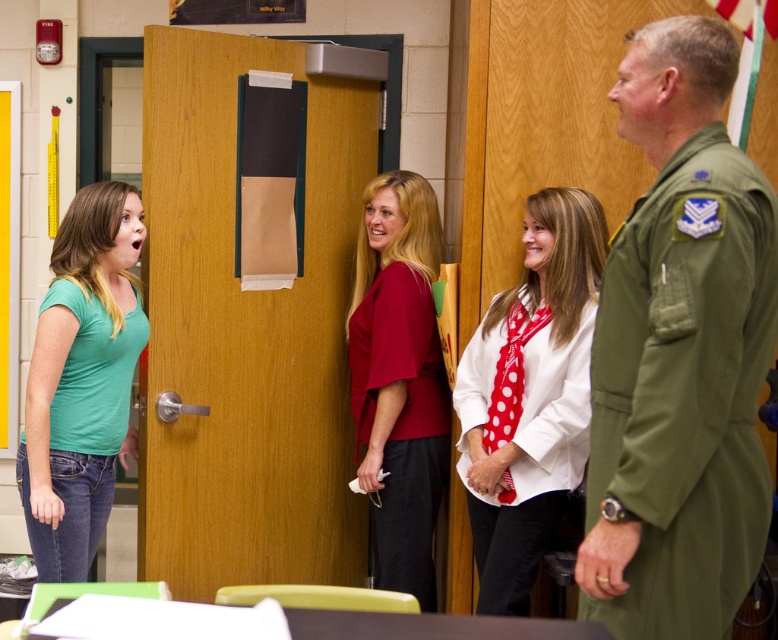
Question: Is green uniform at right thinner than matte red blouse at center?

Choices:
 (A) yes
 (B) no

Answer: (B)

Question: Is matte red blouse at center closer to the viewer compared to white matte shirt at center?

Choices:
 (A) no
 (B) yes

Answer: (A)

Question: Does matte red blouse at center appear over white matte shirt at center?

Choices:
 (A) yes
 (B) no

Answer: (A)

Question: Which of the following is the farthest from the observer?

Choices:
 (A) matte red blouse at center
 (B) green matte shirt at left
 (C) white matte shirt at center
 (D) green uniform at right

Answer: (A)

Question: Which of the following is the farthest from the observer?

Choices:
 (A) white matte shirt at center
 (B) green matte shirt at left
 (C) green uniform at right

Answer: (B)

Question: Which of these objects is positioned closest to the matte red blouse at center?

Choices:
 (A) white matte shirt at center
 (B) green uniform at right
 (C) green matte shirt at left

Answer: (A)